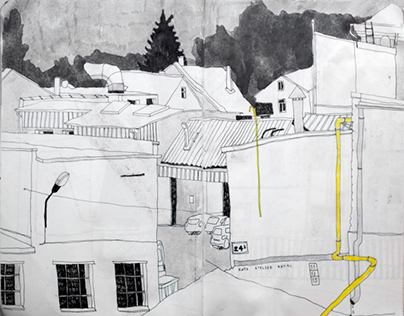
Locate an element on the screen. Image resolution: width=404 pixels, height=316 pixels. ladder is located at coordinates (365, 28).